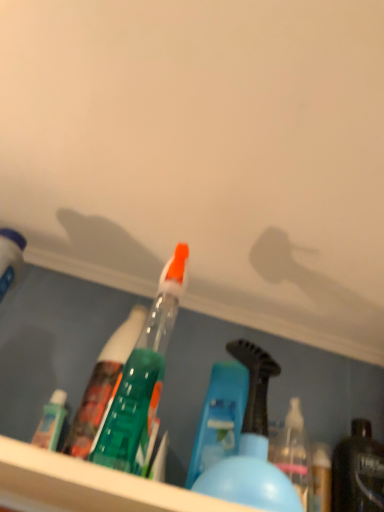
Question: Which is correct: blue plastic bottle at center, the 2th bottle from the right, is inside shiny black bottle at lower right, the 3th bottle from the left, or outside of it?

Choices:
 (A) inside
 (B) outside

Answer: (B)

Question: From a real-world perspective, is blue plastic bottle at center, the 2th bottle from the right, positioned above or below shiny black bottle at lower right, the first bottle in the right-to-left sequence?

Choices:
 (A) above
 (B) below

Answer: (B)

Question: Based on their relative distances, which object is nearer to the matte white bottle at left, positioned as the 3th bottle in right-to-left order?

Choices:
 (A) shiny black bottle at lower right, the 3th bottle from the left
 (B) blue plastic bottle at center, the 2th bottle from the right

Answer: (B)

Question: Considering the real-world distances, which object is closest to the shiny black bottle at lower right, the 3th bottle from the left?

Choices:
 (A) matte white bottle at left, the 1th bottle from the left
 (B) blue plastic bottle at center, which is the second bottle in left-to-right order

Answer: (B)